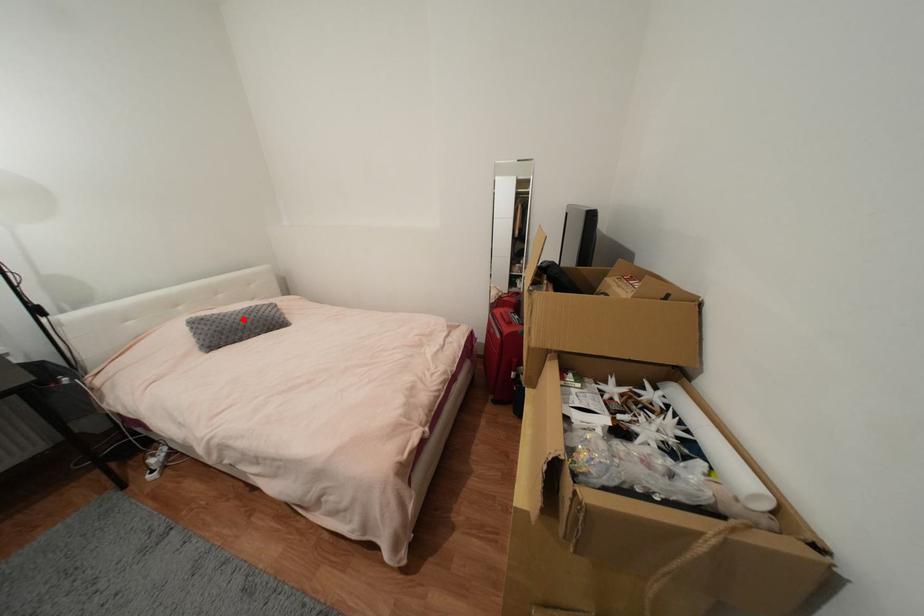
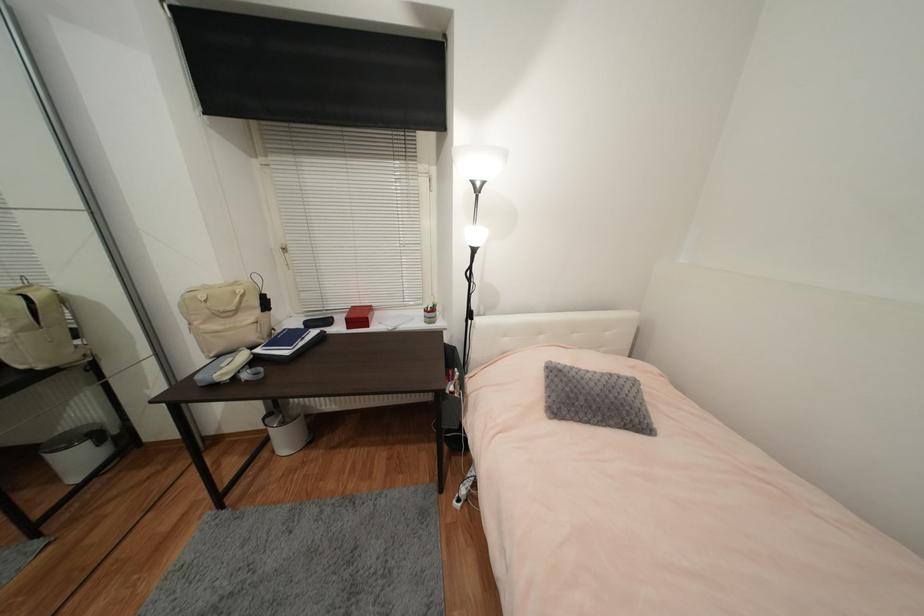
Question: I am providing you with two images of the same scene from different viewpoints. In image1, a red point is highlighted. Considering the same 3D point in image2, which of the following is correct?

Choices:
 (A) It is closer
 (B) It is farther

Answer: (B)